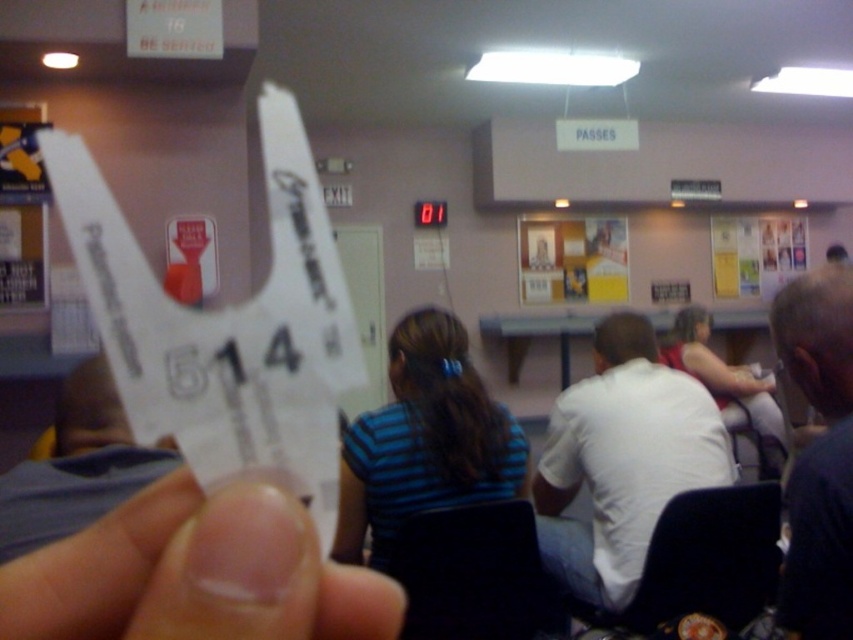
Can you confirm if white matte shirt at center is positioned to the right of gray fabric shirt at right?

Correct, you'll find white matte shirt at center to the right of gray fabric shirt at right.

Who is more forward, (595, 388) or (840, 545)?

Point (840, 545) is more forward.

Identify the location of white matte shirt at center. This screenshot has width=853, height=640. pos(622,460).

Measure the distance between white matte shirt at center and blue striped shirt at center.

white matte shirt at center is 15.32 inches from blue striped shirt at center.

Does white matte shirt at center appear under blue striped shirt at center?

Yes.

Locate an element on the screen. white matte shirt at center is located at coordinates (622, 460).

Is wooden bulletin board at upper center below matte white shirt at center?

No.

Which is below, wooden bulletin board at upper center or matte white shirt at center?

matte white shirt at center is below.

Who is more forward, (611, 248) or (752, 385)?

Point (752, 385)

Find the location of `wooden bulletin board at upper center`. wooden bulletin board at upper center is located at coordinates pyautogui.click(x=572, y=259).